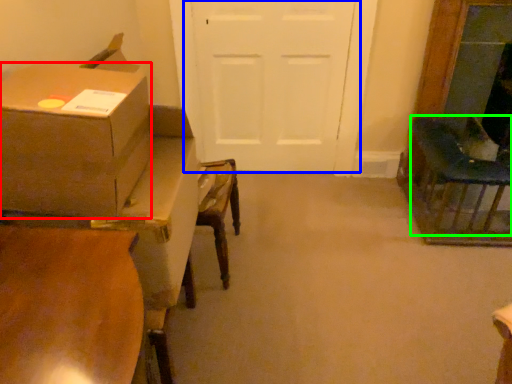
Question: Estimate the real-world distances between objects in this image. Which object is farther from box (highlighted by a red box), door (highlighted by a blue box) or chair (highlighted by a green box)?

Choices:
 (A) door
 (B) chair

Answer: (B)